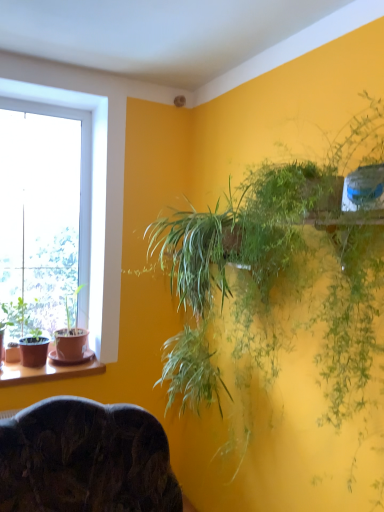
Question: From a real-world perspective, is green matte pot at left, arranged as the second houseplant when viewed from the back, below matte brown pot at left, which appears as the second houseplant when viewed from the right?

Choices:
 (A) yes
 (B) no

Answer: (A)

Question: Is matte brown pot at left, the first houseplant from the back, a part of green matte pot at left, which appears as the 3th houseplant when viewed from the right?

Choices:
 (A) no
 (B) yes

Answer: (A)

Question: Considering the relative sizes of green matte pot at left, which appears as the 3th houseplant when viewed from the right, and matte brown pot at left, arranged as the second houseplant when viewed from the left, in the image provided, is green matte pot at left, which appears as the 3th houseplant when viewed from the right, wider than matte brown pot at left, arranged as the second houseplant when viewed from the left,?

Choices:
 (A) no
 (B) yes

Answer: (A)

Question: Is green matte pot at left, arranged as the second houseplant when viewed from the back, not close to matte brown pot at left, arranged as the second houseplant when viewed from the left?

Choices:
 (A) yes
 (B) no

Answer: (B)

Question: Can you confirm if green matte pot at left, which appears as the 1th houseplant when viewed from the left, is taller than matte brown pot at left, which ranks as the 3th houseplant in front-to-back order?

Choices:
 (A) yes
 (B) no

Answer: (B)

Question: From a real-world perspective, is matte brown pot at left, which ranks as the 3th houseplant in front-to-back order, positioned above or below dark wood chair at lower center?

Choices:
 (A) above
 (B) below

Answer: (A)

Question: From the image's perspective, is matte brown pot at left, arranged as the second houseplant when viewed from the left, above or below dark wood chair at lower center?

Choices:
 (A) above
 (B) below

Answer: (A)

Question: In the image, is matte brown pot at left, arranged as the second houseplant when viewed from the left, on the left side or the right side of dark wood chair at lower center?

Choices:
 (A) left
 (B) right

Answer: (A)

Question: Does point (82, 347) appear closer or farther from the camera than point (173, 485)?

Choices:
 (A) closer
 (B) farther

Answer: (B)

Question: Is brown wooden window sill at lower left taller or shorter than matte brown pot at left, which ranks as the 3th houseplant in front-to-back order?

Choices:
 (A) tall
 (B) short

Answer: (B)

Question: From a real-world perspective, is brown wooden window sill at lower left above or below matte brown pot at left, which ranks as the 3th houseplant in front-to-back order?

Choices:
 (A) above
 (B) below

Answer: (B)

Question: From the image's perspective, is brown wooden window sill at lower left above or below matte brown pot at left, the first houseplant from the back?

Choices:
 (A) below
 (B) above

Answer: (A)

Question: Is brown wooden window sill at lower left inside or outside of matte brown pot at left, the first houseplant from the back?

Choices:
 (A) inside
 (B) outside

Answer: (B)

Question: Considering the relative positions of green leafy plant at upper right, the 1th houseplant viewed from the right, and green matte pot at left, which appears as the 3th houseplant when viewed from the right, in the image provided, is green leafy plant at upper right, the 1th houseplant viewed from the right, to the left or to the right of green matte pot at left, which appears as the 3th houseplant when viewed from the right,?

Choices:
 (A) right
 (B) left

Answer: (A)

Question: Is green leafy plant at upper right, the 1th houseplant viewed from the right, spatially inside green matte pot at left, which appears as the 3th houseplant when viewed from the right, or outside of it?

Choices:
 (A) outside
 (B) inside

Answer: (A)